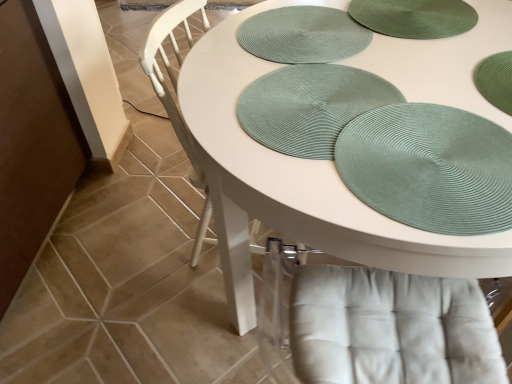
I want to click on vacant space to the right of green textured placemat at upper center, placed as the 1th platter when sorted from back to front, so click(x=426, y=41).